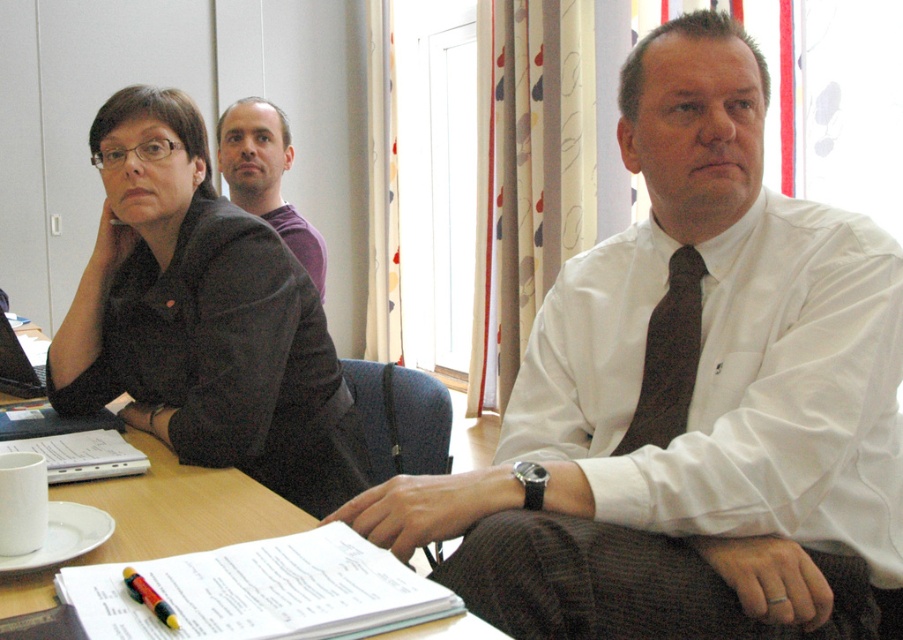
Is point (58, 406) in front of point (131, 579)?

No, (58, 406) is behind (131, 579).

Locate an element on the screen. This screenshot has width=903, height=640. matte black shirt at upper left is located at coordinates (202, 317).

Which is in front, point (104, 234) or point (126, 572)?

Point (126, 572) is in front.

The height and width of the screenshot is (640, 903). What are the coordinates of `matte black shirt at upper left` in the screenshot? It's located at (202, 317).

Between point (749, 131) and point (286, 240), which one is positioned in front?

Point (749, 131) is more forward.

Which is more to the left, white shirt at center or purple cotton shirt at upper center?

purple cotton shirt at upper center is more to the left.

Is point (528, 484) less distant than point (303, 259)?

Yes, it is in front of point (303, 259).

Where is `white shirt at center`? white shirt at center is located at coordinates tap(690, 401).

Does white shirt at center have a greater width compared to multicolored plastic pen at lower left?

Indeed, white shirt at center has a greater width compared to multicolored plastic pen at lower left.

How far apart are white shirt at center and multicolored plastic pen at lower left?

white shirt at center is 25.37 inches from multicolored plastic pen at lower left.

Locate an element on the screen. This screenshot has width=903, height=640. white shirt at center is located at coordinates pos(690,401).